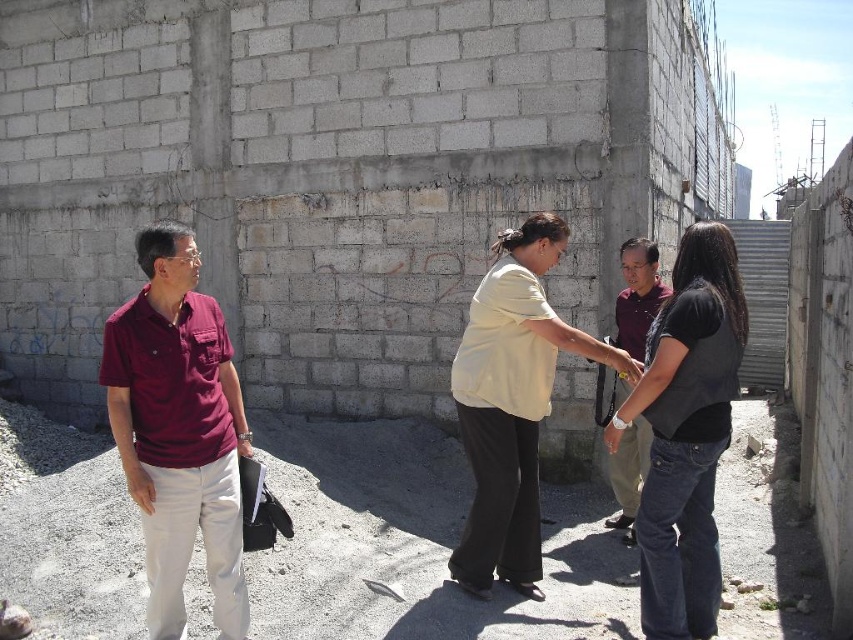
Question: Is light yellow cotton shirt at center in front of maroon shirt at center?

Choices:
 (A) yes
 (B) no

Answer: (A)

Question: Does maroon fabric shirt at left have a greater width compared to light yellow cotton shirt at center?

Choices:
 (A) no
 (B) yes

Answer: (A)

Question: Is maroon fabric shirt at left below black denim jeans at lower right?

Choices:
 (A) yes
 (B) no

Answer: (A)

Question: Which point is farther to the camera?

Choices:
 (A) maroon fabric shirt at left
 (B) maroon shirt at center
 (C) black denim jeans at lower right

Answer: (B)

Question: Which point is farther to the camera?

Choices:
 (A) (672, 577)
 (B) (637, 284)

Answer: (B)

Question: Estimate the real-world distances between objects in this image. Which object is closer to the maroon shirt at center?

Choices:
 (A) light yellow cotton shirt at center
 (B) black denim jeans at lower right

Answer: (A)